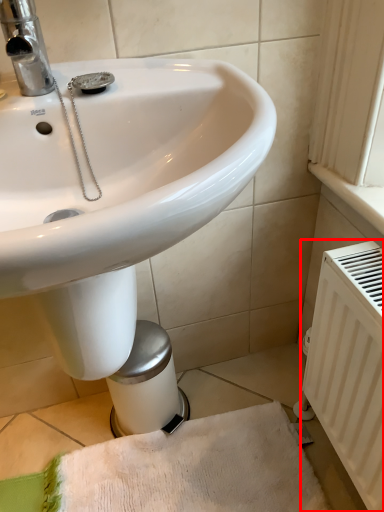
Question: From the image's perspective, where is radiator (annotated by the red box) located in relation to bath towel in the image?

Choices:
 (A) below
 (B) above

Answer: (B)